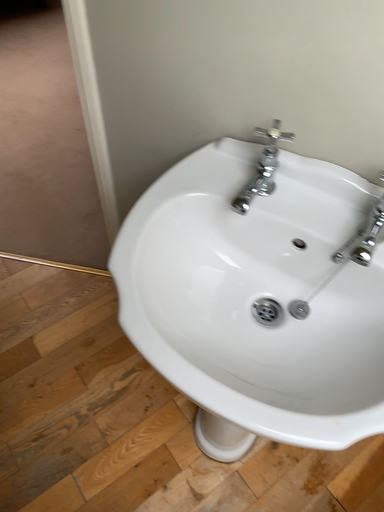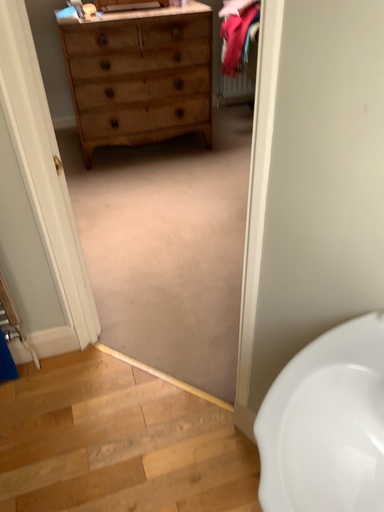
Question: Which way did the camera rotate in the video?

Choices:
 (A) rotated upward
 (B) rotated downward

Answer: (A)